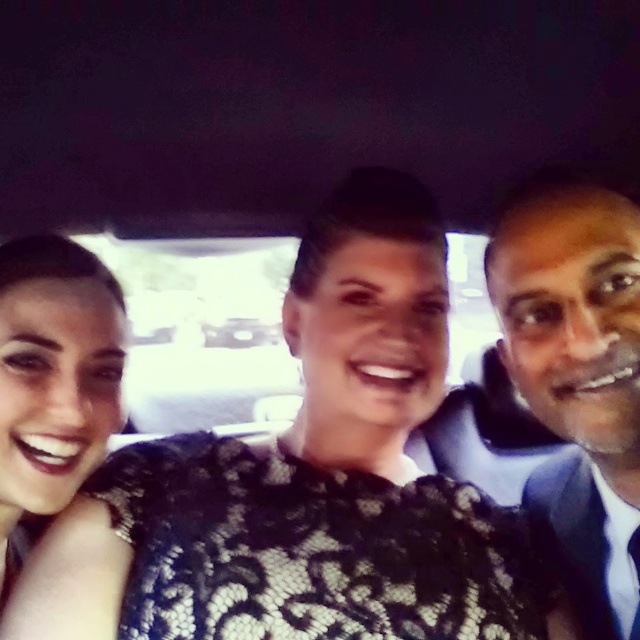
In the scene shown: Can you confirm if blue suit at right is taller than matte black dress at left?

Yes.

Is point (529, 490) positioned before point (112, 273)?

No.

Locate an element on the screen. This screenshot has height=640, width=640. blue suit at right is located at coordinates (577, 378).

Based on the photo, does black lace dress at center appear under matte black dress at left?

Indeed, black lace dress at center is positioned under matte black dress at left.

Can you confirm if black lace dress at center is shorter than matte black dress at left?

No, black lace dress at center is not shorter than matte black dress at left.

At what (x,y) coordinates should I click in order to perform the action: click on black lace dress at center. Please return your answer as a coordinate pair (x, y). Looking at the image, I should click on (307, 481).

Looking at this image, who is taller, black lace dress at center or blue suit at right?

Standing taller between the two is blue suit at right.

Is point (45, 586) positioned in front of point (513, 342)?

Yes, it is in front of point (513, 342).

Does point (67, 548) lie in front of point (628, 256)?

No.

At what (x,y) coordinates should I click in order to perform the action: click on black lace dress at center. Please return your answer as a coordinate pair (x, y). Looking at the image, I should click on (307, 481).